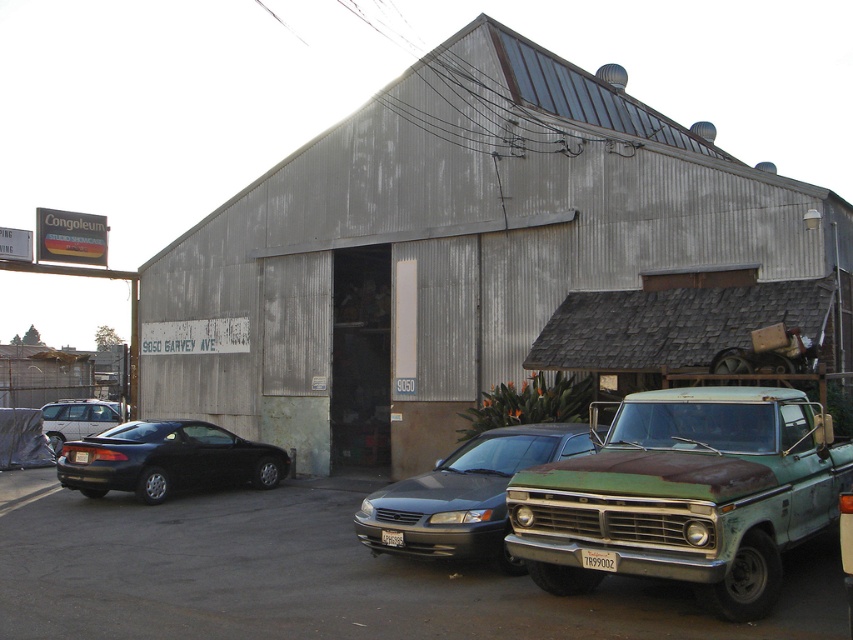
You are driving a delivery van that is 12 feet long. You see the rusty corrugated metal barn at center and the shiny black car at center in the parking lot. Can your van fit between them if they are parked parallel to each other?

The rusty corrugated metal barn at center is bigger than the shiny black car at center, but without knowing the exact distance between them, it is impossible to determine if the van can fit. Please check the space between them first.

You are a delivery driver who needs to park your vehicle between the shiny black car at center and the matte black car at left. Based on their positions, can you fit your truck which is 6 meters long?

The shiny black car at center is below matte black car at left. Therefore, the distance between them is not specified in the description, so it is unclear if your truck can fit. You should check the available space physically before attempting to park.

You are driving a car and want to park in front of the rusty corrugated metal barn at center. There is a matte black sedan at center already parked there. Can you park your car in front of the barn without going behind the sedan?

The matte black sedan at center is behind the rusty corrugated metal barn at center, so you can park in front of the barn without going behind the sedan.